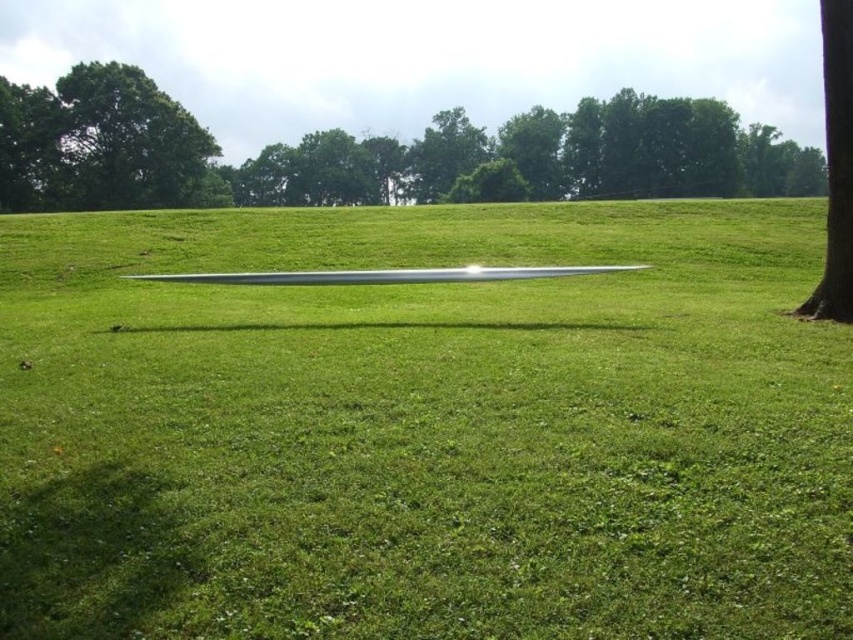
Question: Among these points, which one is farthest from the camera?

Choices:
 (A) (163, 276)
 (B) (849, 236)

Answer: (A)

Question: Does green grassy field at center have a lesser width compared to silver metallic blade at center?

Choices:
 (A) no
 (B) yes

Answer: (A)

Question: Observing the image, what is the correct spatial positioning of green leafy tree at upper left in reference to brown textured tree trunk at right?

Choices:
 (A) left
 (B) right

Answer: (A)

Question: Which object is closer to the camera taking this photo?

Choices:
 (A) green leafy tree at upper left
 (B) silver metallic blade at center
 (C) brown textured tree trunk at right

Answer: (C)

Question: Which of the following is the farthest from the observer?

Choices:
 (A) (187, 112)
 (B) (848, 4)
 (C) (619, 440)
 (D) (361, 273)

Answer: (A)

Question: Can you confirm if brown textured tree trunk at right is wider than silver metallic blade at center?

Choices:
 (A) yes
 (B) no

Answer: (B)